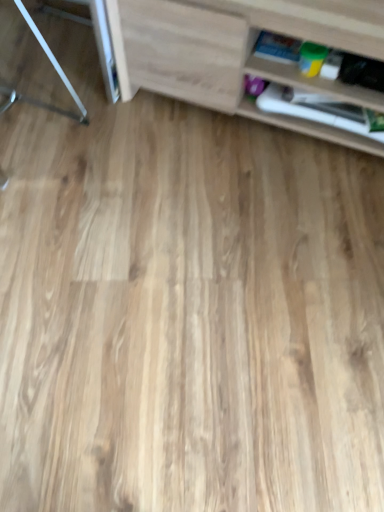
This screenshot has width=384, height=512. Identify the location of free spot in front of metallic silver table at left. (67, 145).